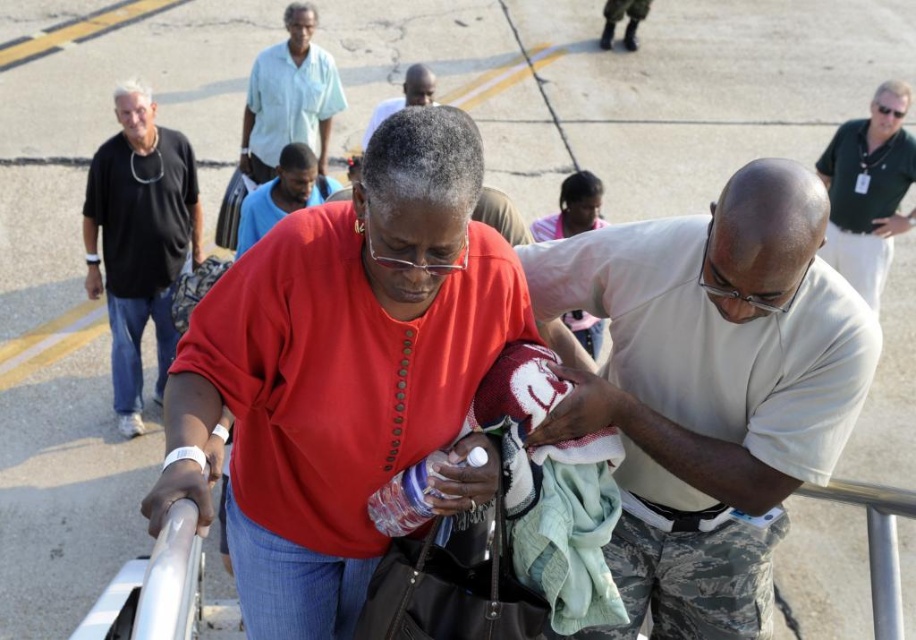
Based on the coordinates provided, which object is located at point (139,241) in the image?

The point (139,241) corresponds to the black matte shirt at left.

You are standing at the base of the staircase and want to reach the point marked as point (170, 362) on the staircase. If your average walking speed is 3 feet per second, how many seconds will it take you to reach that point?

The distance of point (170, 362) from viewer is 24.57 feet. At a speed of 3 feet per second, it would take approximately 8.19 seconds to reach the point.